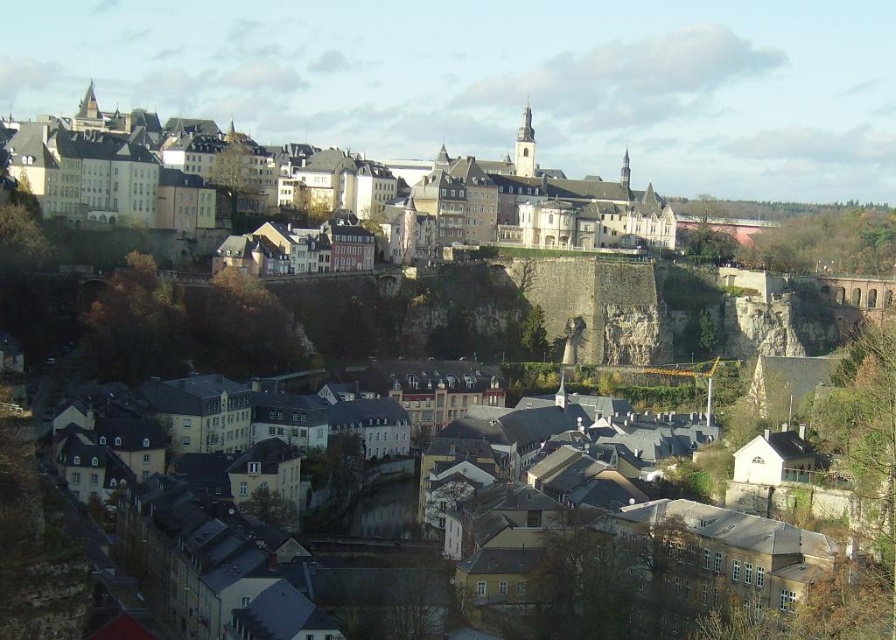
In the scene shown: Can you confirm if matte stone castle at upper left is positioned below yellow stone buildings at center?

No.

Does matte stone castle at upper left appear on the right side of yellow stone buildings at center?

In fact, matte stone castle at upper left is to the left of yellow stone buildings at center.

Is point (510, 161) behind point (600, 605)?

Yes, it is behind point (600, 605).

Locate an element on the screen. The image size is (896, 640). matte stone castle at upper left is located at coordinates (330, 188).